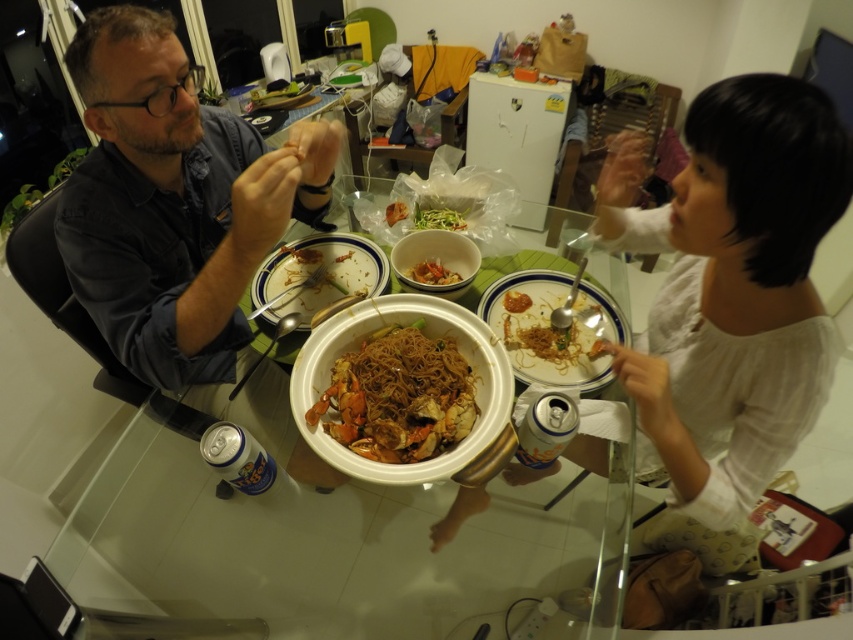
Question: Can you confirm if transparent glass table at center is bigger than brown matte noodles at center?

Choices:
 (A) no
 (B) yes

Answer: (B)

Question: Which of the following is the farthest from the observer?

Choices:
 (A) brown matte noodles at right
 (B) green matte vegetable at center
 (C) shiny orange crab at center
 (D) transparent glass table at center

Answer: (B)

Question: Estimate the real-world distances between objects in this image. Which object is closer to the matte black shirt at left?

Choices:
 (A) transparent glass table at center
 (B) brown matte noodles at right

Answer: (A)

Question: Which object appears closest to the camera in this image?

Choices:
 (A) transparent glass table at center
 (B) shiny orange crab at center

Answer: (A)

Question: Is the position of transparent glass table at center more distant than that of shiny orange crab at center?

Choices:
 (A) no
 (B) yes

Answer: (A)

Question: Can you confirm if matte black shirt at left is bigger than brown matte noodles at right?

Choices:
 (A) no
 (B) yes

Answer: (B)